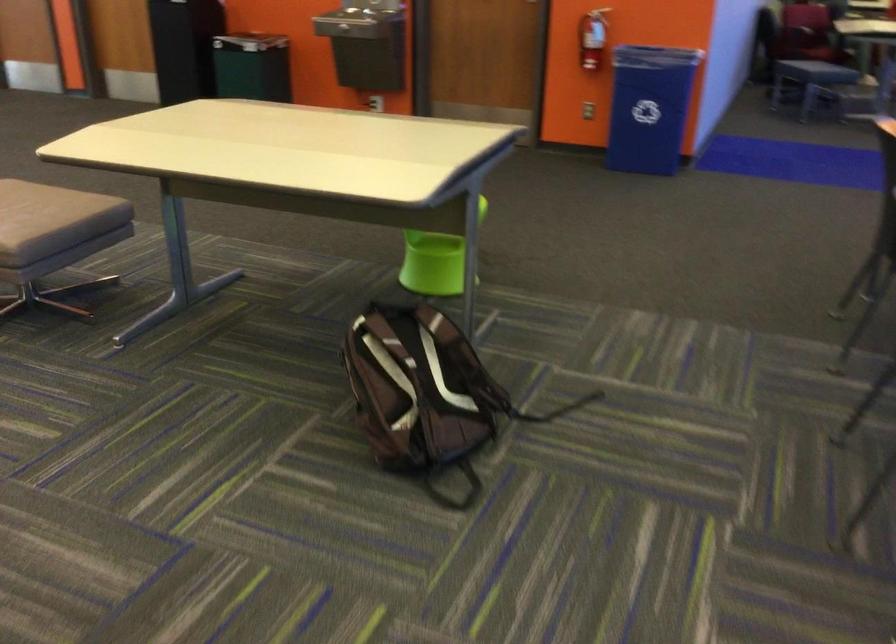
Where would you press the water fountain button? Please return your answer as a coordinate pair (x, y).

(332, 28)